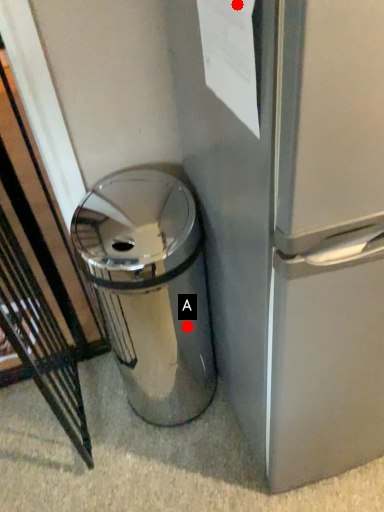
Question: Two points are circled on the image, labeled by A and B beside each circle. Which point is further to the camera?

Choices:
 (A) A is further
 (B) B is further

Answer: (A)